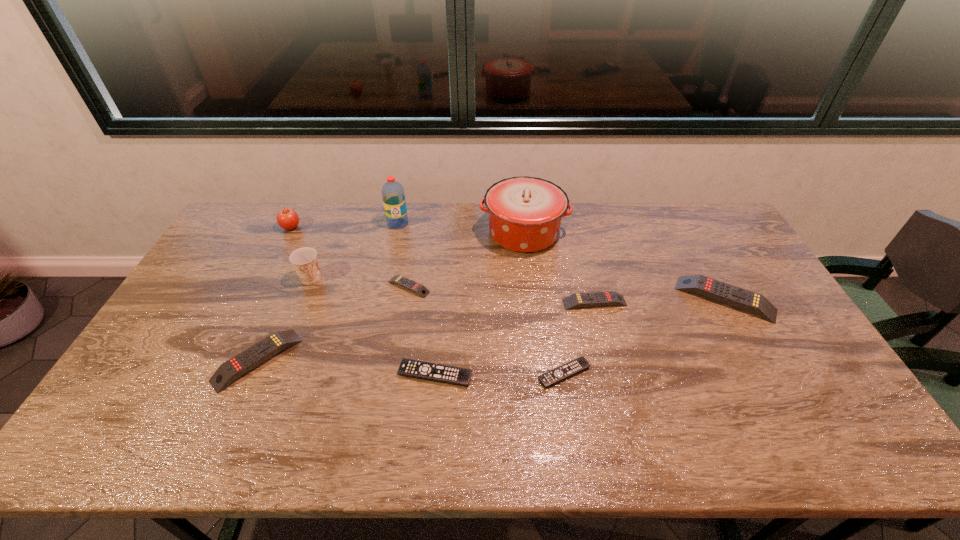
Identify the location of red water bottle. This screenshot has height=540, width=960. (393, 195).

Where is `casserole`? The height and width of the screenshot is (540, 960). casserole is located at coordinates (525, 213).

This screenshot has width=960, height=540. What are the coordinates of `orange Dixie cup` in the screenshot? It's located at (304, 260).

Find the location of a particular element. The width and height of the screenshot is (960, 540). apple is located at coordinates (287, 218).

What are the coordinates of `the fifth tallest object` in the screenshot? It's located at (732, 295).

Where is `the tallest remote control`? The image size is (960, 540). the tallest remote control is located at coordinates (732, 295).

In order to click on the nearest yellow remote control in this screenshot , I will do `click(250, 358)`.

The width and height of the screenshot is (960, 540). I want to click on the third smallest yellow remote control, so click(250, 358).

Where is `the third biggest yellow remote control`? This screenshot has width=960, height=540. the third biggest yellow remote control is located at coordinates (608, 298).

Identify the location of the third yellow remote control from left to right. (608, 298).